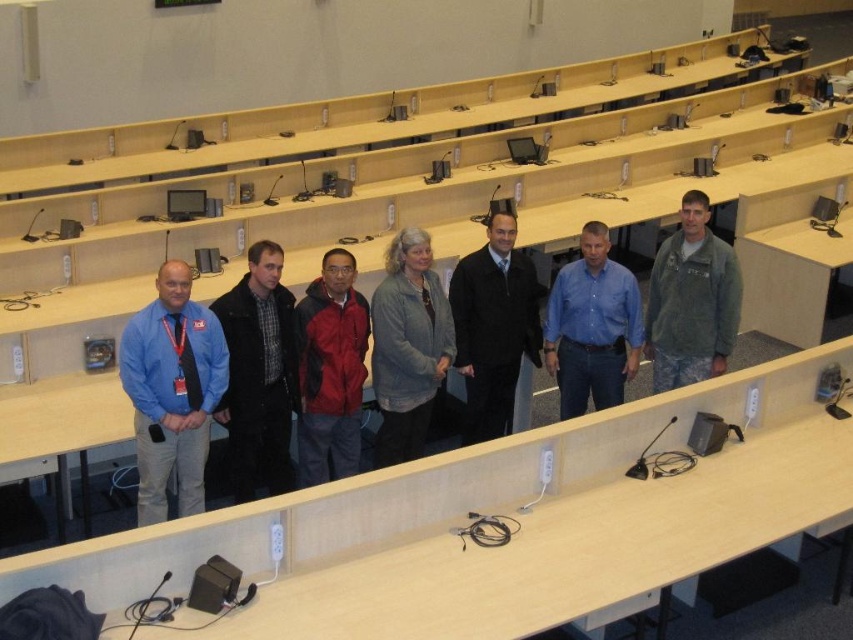
Between gray fleece jacket at center and red matte jacket at center, which one appears on the left side from the viewer's perspective?

red matte jacket at center is more to the left.

Does gray fleece jacket at center have a greater width compared to red matte jacket at center?

Correct, the width of gray fleece jacket at center exceeds that of red matte jacket at center.

You are a GUI agent. You are given a task and a screenshot of the screen. Output one action in this format:
    pyautogui.click(x=<x>, y=<y>)
    Task: Click on the gray fleece jacket at center
    Image resolution: width=853 pixels, height=640 pixels.
    Given the screenshot: What is the action you would take?
    pyautogui.click(x=407, y=346)

Is camouflage jacket at center wider than blue denim shirt at center?

No, camouflage jacket at center is not wider than blue denim shirt at center.

Which of these two, camouflage jacket at center or blue denim shirt at center, stands taller?

Standing taller between the two is camouflage jacket at center.

Which is behind, point (682, 291) or point (549, 308)?

The point (549, 308) is behind.

Where is `camouflage jacket at center`? This screenshot has width=853, height=640. camouflage jacket at center is located at coordinates (691, 300).

Does red matte jacket at center appear over blue denim shirt at center?

Incorrect, red matte jacket at center is not positioned above blue denim shirt at center.

In the scene shown: Which is more to the left, red matte jacket at center or blue denim shirt at center?

red matte jacket at center

Is point (331, 432) farther from camera compared to point (556, 310)?

No.

This screenshot has height=640, width=853. What are the coordinates of `red matte jacket at center` in the screenshot? It's located at (329, 371).